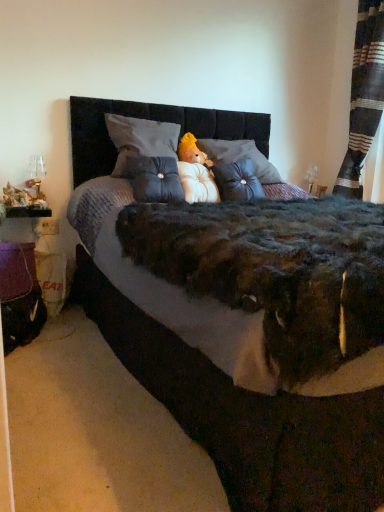
Question: Considering the positions of point (196, 352) and point (206, 160), is point (196, 352) closer or farther from the camera than point (206, 160)?

Choices:
 (A) farther
 (B) closer

Answer: (B)

Question: In the image, is velvet black bed at center positioned in front of or behind fluffy white teddy bear at center?

Choices:
 (A) front
 (B) behind

Answer: (A)

Question: Based on their relative distances, which object is farther from the white plush bear at center?

Choices:
 (A) striped fabric curtain at right
 (B) white soft pillow at center
 (C) velvet black bed at center
 (D) fluffy white teddy bear at center
 (E) velvet gray throw pillow at center, the 2th throw pillow viewed from the left

Answer: (A)

Question: Considering the real-world distances, which object is farthest from the velvet black bed at center?

Choices:
 (A) purple fabric table at lower left
 (B) velvet gray throw pillow at center, the 2th throw pillow viewed from the left
 (C) white soft pillow at center
 (D) striped fabric curtain at right
 (E) tufted fabric pillow at center, which appears as the first throw pillow when viewed from the left

Answer: (D)